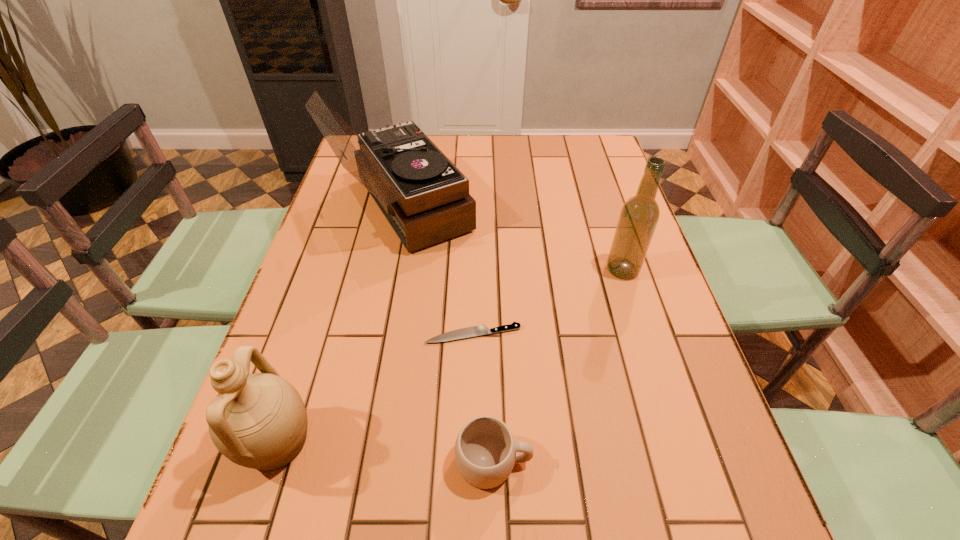
At what (x,y) coordinates should I click in order to perform the action: click on the rightmost object. Please return your answer as a coordinate pair (x, y). The image size is (960, 540). Looking at the image, I should click on (639, 216).

I want to click on record player, so click(425, 198).

Locate an element on the screen. the third shortest object is located at coordinates pos(259,421).

This screenshot has width=960, height=540. I want to click on mug, so [485, 449].

This screenshot has width=960, height=540. In order to click on the third nearest object in this screenshot , I will do pos(479,330).

Where is `the shortest object`? the shortest object is located at coordinates (479, 330).

Identify the location of free spot located on the back of the liquor. click(x=592, y=175).

I want to click on free space located on the back of the record player, so click(414, 147).

Locate an element on the screen. vacant space located on the back of the pitcher is located at coordinates (336, 262).

The image size is (960, 540). Identify the location of vacant position located 0.050m on the side of the mug with the handle. (560, 461).